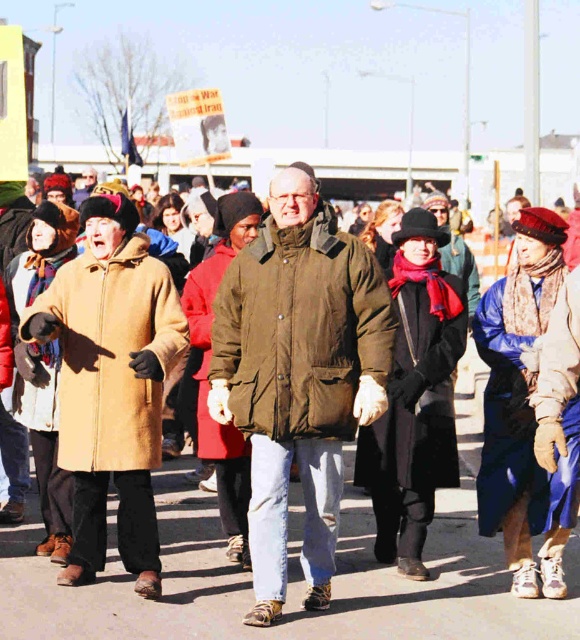
You are standing at the camera position and want to throw a ball to the point at coordinates point (x=342, y=236). Can you estimate how far you need to throw the ball in meters?

The distance of point (x=342, y=236) from camera is 5.90 meters, so you need to throw the ball approximately 5.90 meters.